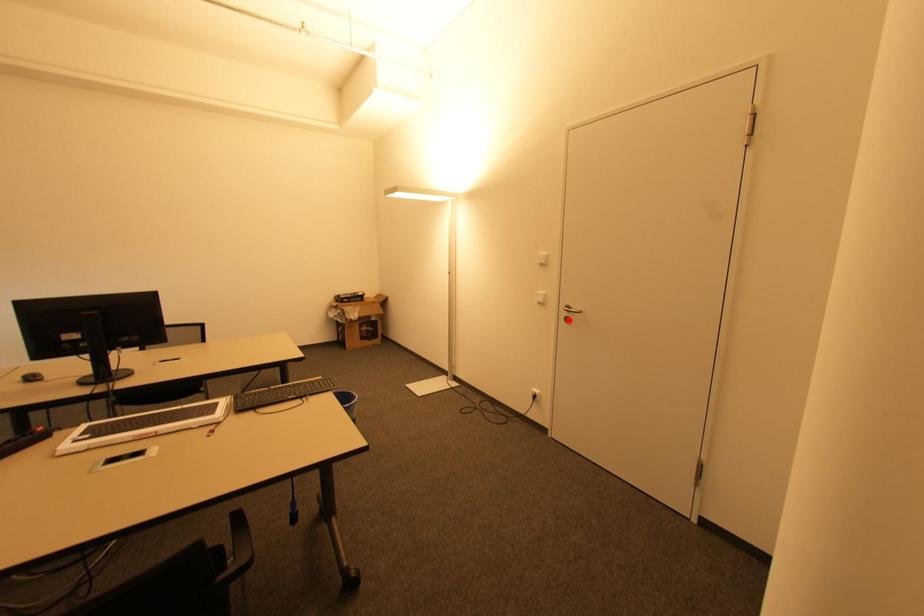
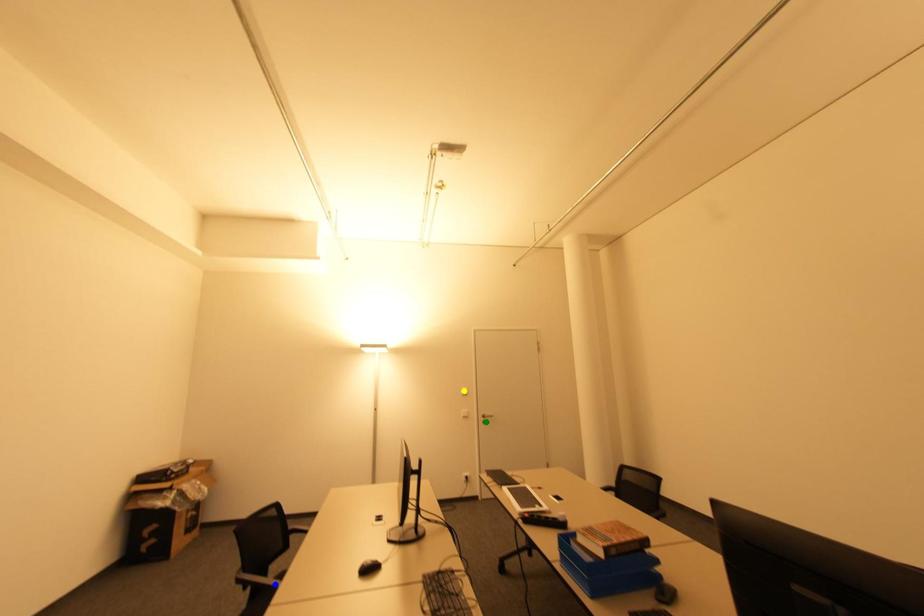
Question: I am providing you with two images of the same scene from different viewpoints. A red point is marked on the first image. You are given multiple points on the second image. Which point in image 2 is actually the same real-world point as the red point in image 1?

Choices:
 (A) yellow point
 (B) blue point
 (C) green point

Answer: (C)